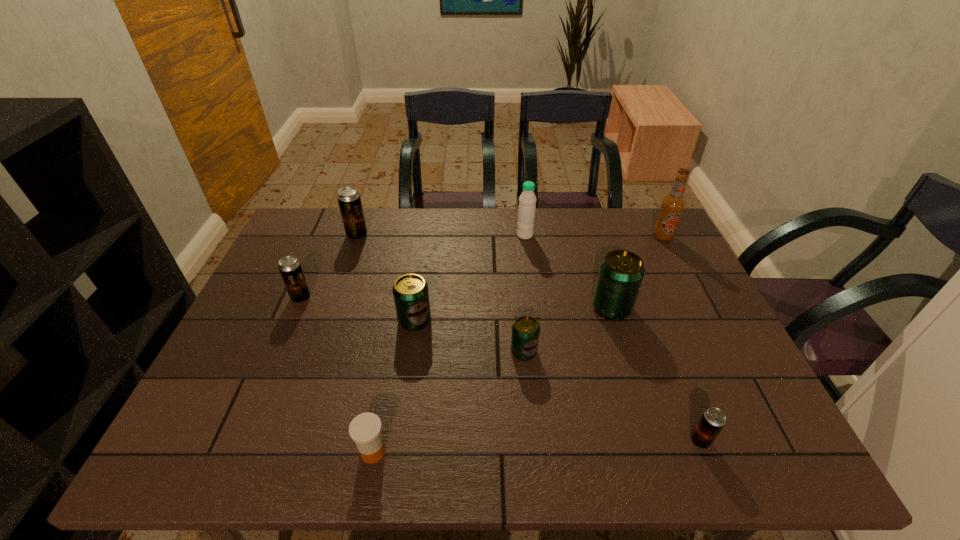
I want to click on the fourth beer can from right to left, so click(411, 296).

Where is `the seventh farthest object`? The width and height of the screenshot is (960, 540). the seventh farthest object is located at coordinates (525, 330).

I want to click on the third beer can from right to left, so click(x=525, y=330).

Find the location of a particular element. The image size is (960, 540). the smallest black beer can is located at coordinates (713, 419).

Locate an element on the screen. This screenshot has height=540, width=960. the nearest beer can is located at coordinates (713, 419).

I want to click on medicine, so click(365, 429).

The image size is (960, 540). What are the coordinates of `vacant area situated 0.280m on the front label of the tallest object` in the screenshot? It's located at (698, 305).

Where is `vacant area situated on the left of the water bottle`? The image size is (960, 540). vacant area situated on the left of the water bottle is located at coordinates (486, 235).

You are a GUI agent. You are given a task and a screenshot of the screen. Output one action in this format:
    pyautogui.click(x=<x>, y=<y>)
    Task: Click on the vacant area situated on the right of the eighth object from right to left
    This screenshot has height=540, width=960.
    Given the screenshot: What is the action you would take?
    pyautogui.click(x=435, y=235)

You are a GUI agent. You are given a task and a screenshot of the screen. Output one action in this format:
    pyautogui.click(x=<x>, y=<y>)
    Task: Click on the free region located 0.050m on the back of the rightmost green beer can
    
    Given the screenshot: What is the action you would take?
    pos(604,282)